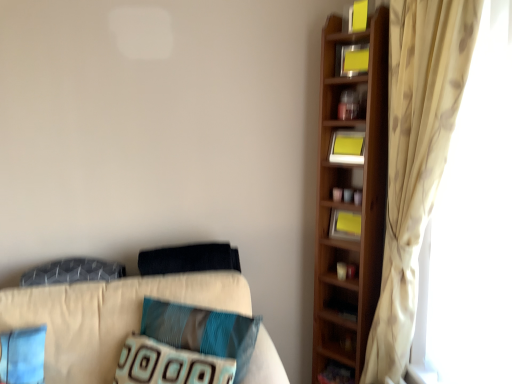
Question: From the image's perspective, is textured blue pillow at center, the first pillow from the bottom, located above or below yellow matte bookshelf at upper right, the second book when ordered from top to bottom?

Choices:
 (A) below
 (B) above

Answer: (A)

Question: In terms of width, does textured blue pillow at center, the first pillow from the bottom, look wider or thinner when compared to yellow matte bookshelf at upper right, which is the 3th book in bottom-to-top order?

Choices:
 (A) thin
 (B) wide

Answer: (B)

Question: Which object is the closest to the yellow paper at upper right, the 3th book in the top-to-bottom sequence?

Choices:
 (A) textured gray pillow at left, positioned as the third pillow in bottom-to-top order
 (B) yellow paper at upper right, the 1th book positioned from the top
 (C) wooden cabinet at lower right, which is the first cabinet in back-to-front order
 (D) yellow paper at upper right, positioned as the 1th book in bottom-to-top order
 (E) wooden cabinet at upper right, which ranks as the 1th cabinet in top-to-bottom order

Answer: (E)

Question: Which of these objects is positioned closest to the yellow paper at upper right, which appears as the fourth book when ordered from the bottom?

Choices:
 (A) yellow paper at upper right, positioned as the 1th book in bottom-to-top order
 (B) yellow matte bookshelf at upper right, the second book when ordered from top to bottom
 (C) teal fabric pillow at center, which is the third pillow in top-to-bottom order
 (D) textured gray pillow at left, positioned as the third pillow in bottom-to-top order
 (E) wooden cabinet at upper right, which ranks as the 1th cabinet in top-to-bottom order

Answer: (B)